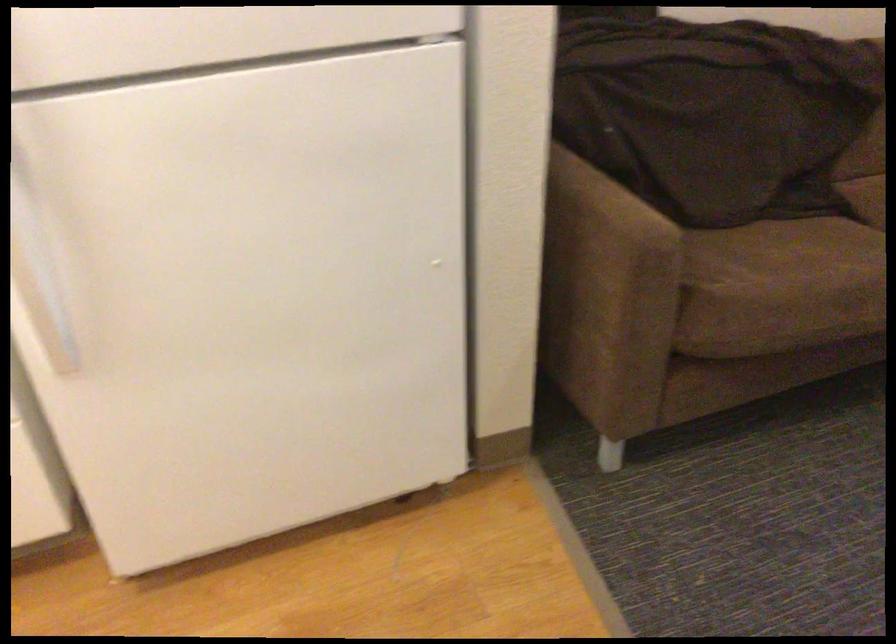
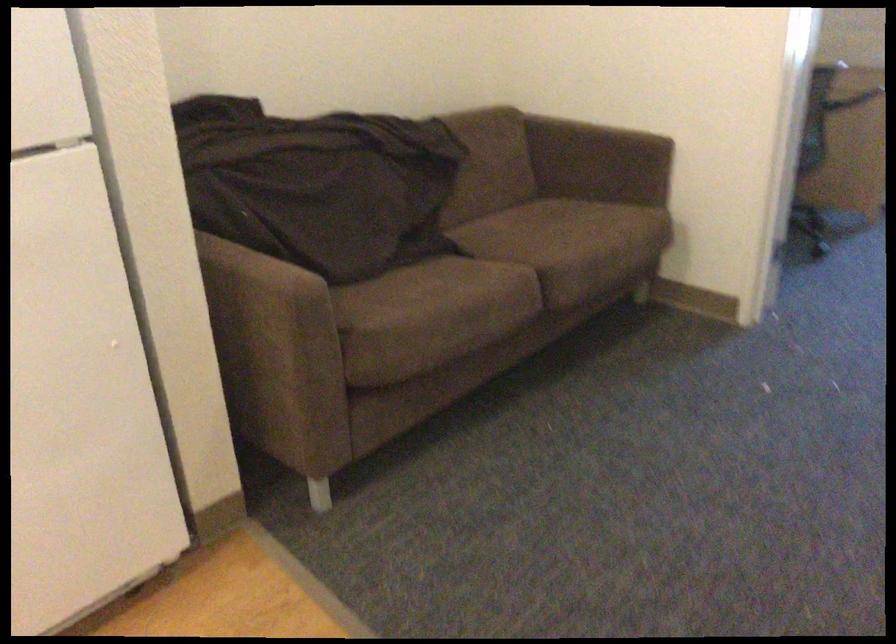
Where in the second image is the point corresponding to point 598,286 from the first image?

(271, 342)